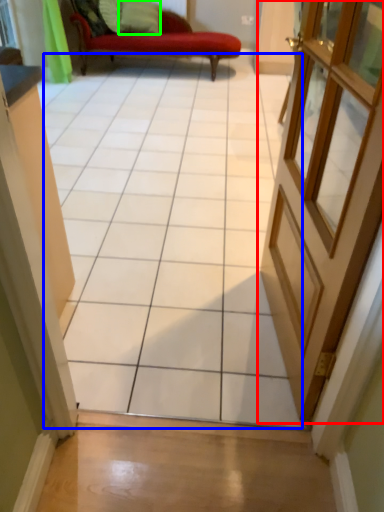
Question: Based on their relative distances, which object is farther from door (highlighted by a red box)? Choose from ceramic tile (highlighted by a blue box) and pillow (highlighted by a green box).

Choices:
 (A) ceramic tile
 (B) pillow

Answer: (B)